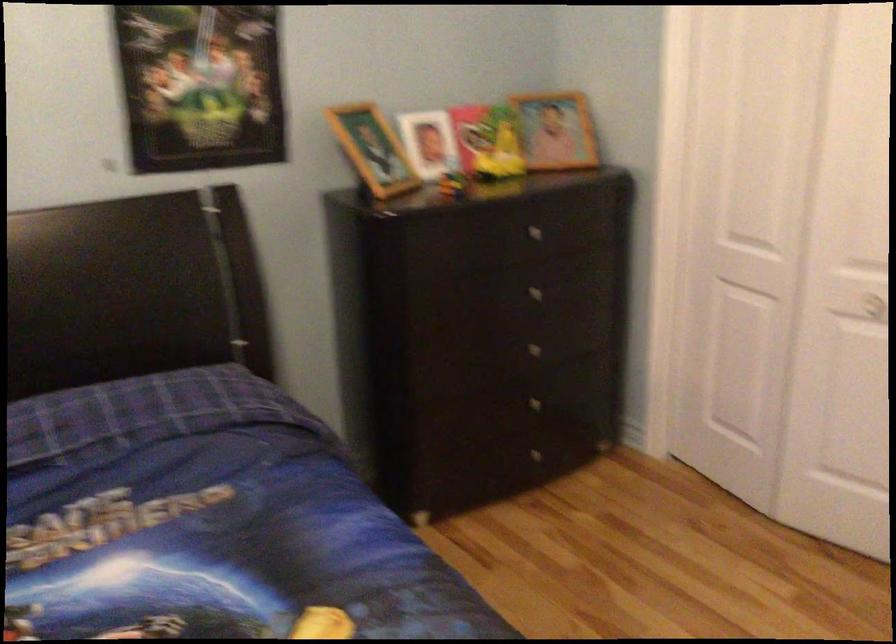
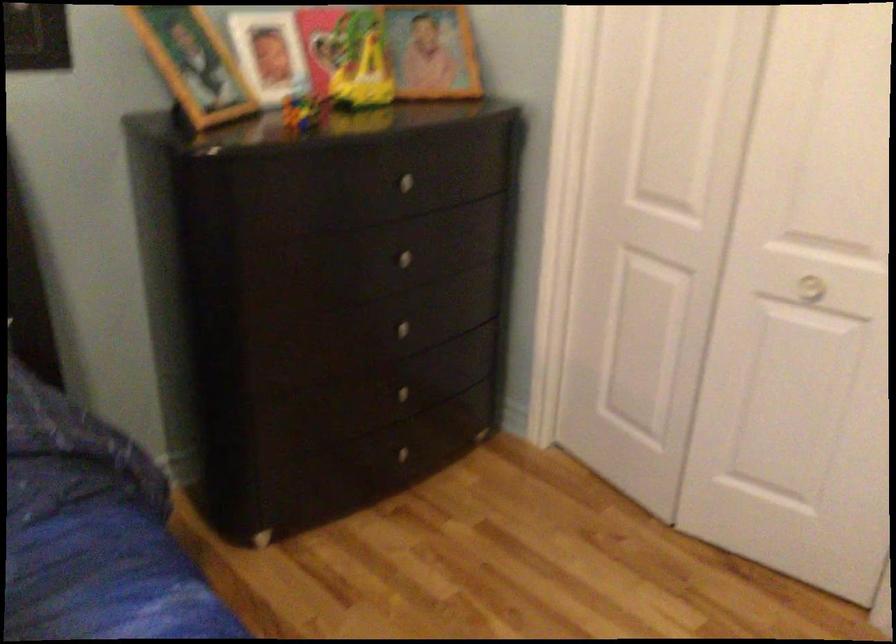
The point at (535, 225) is marked in the first image. Where is the corresponding point in the second image?

(408, 178)